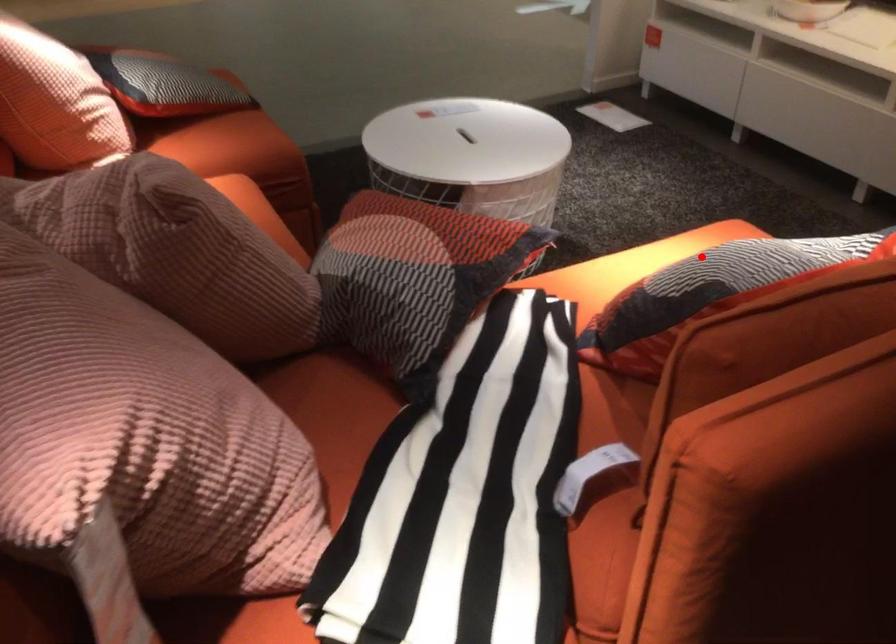
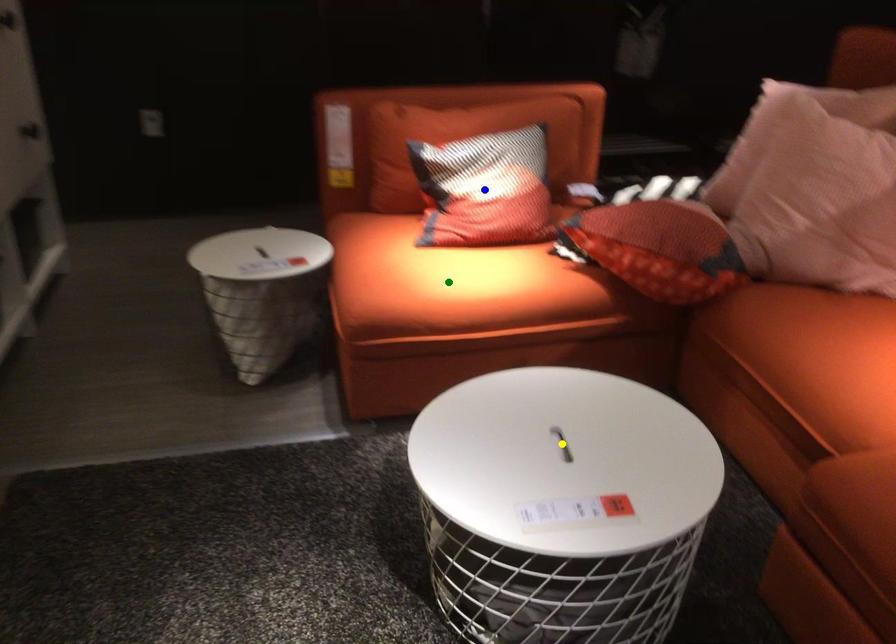
Question: I am providing you with two images of the same scene from different viewpoints. A red point is marked on the first image. You are given multiple points on the second image. Which point in image 2 represents the same 3d spot as the red point in image 1?

Choices:
 (A) blue point
 (B) yellow point
 (C) green point

Answer: (A)